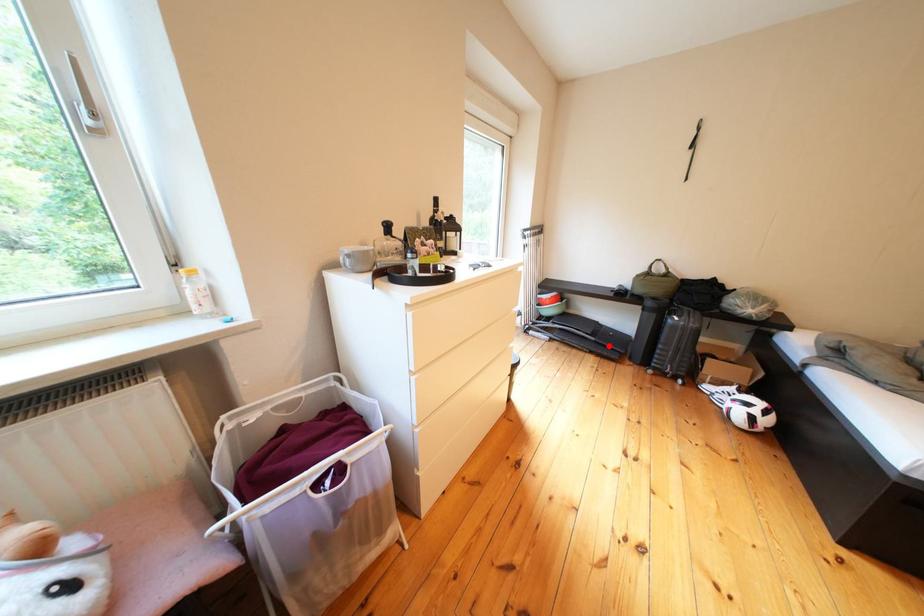
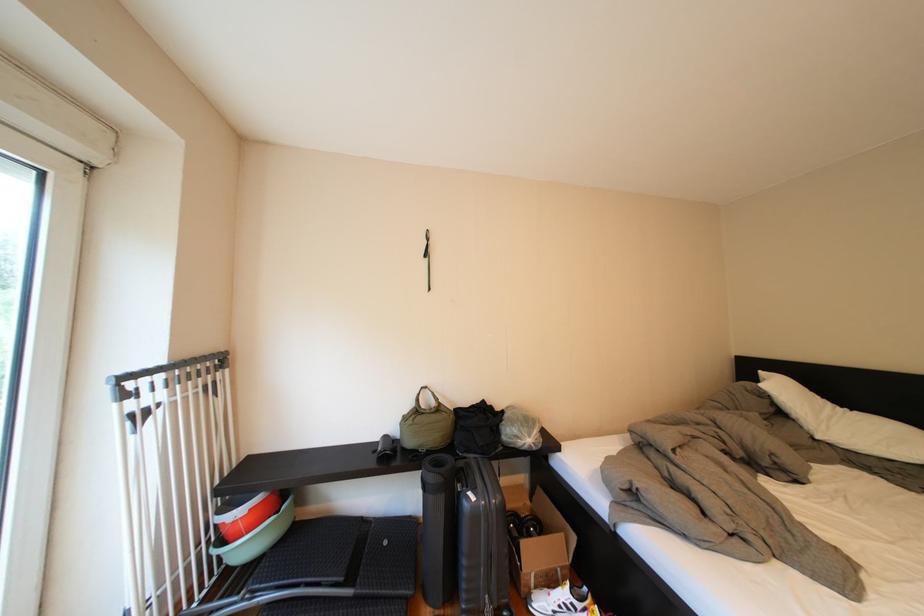
The point at the highlighted location is marked in the first image. Where is the corresponding point in the second image?

(370, 602)